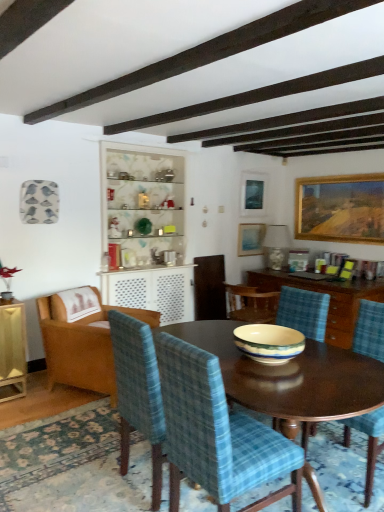
Question: Is white glossy cabinet at center at the left side of matte glass picture frame at upper center, placed as the second picture frame when sorted from left to right?

Choices:
 (A) no
 (B) yes

Answer: (B)

Question: Is white glossy cabinet at center positioned in front of matte glass picture frame at upper center, placed as the second picture frame when sorted from left to right?

Choices:
 (A) yes
 (B) no

Answer: (A)

Question: Does white glossy cabinet at center turn towards matte glass picture frame at upper center, placed as the second picture frame when sorted from left to right?

Choices:
 (A) no
 (B) yes

Answer: (A)

Question: Can you confirm if white glossy cabinet at center is thinner than matte glass picture frame at upper center, arranged as the 2th picture frame when viewed from the right?

Choices:
 (A) yes
 (B) no

Answer: (B)

Question: Can we say white glossy cabinet at center lies outside matte glass picture frame at upper center, arranged as the 2th picture frame when viewed from the right?

Choices:
 (A) yes
 (B) no

Answer: (A)

Question: In terms of size, does matte blue picture frame at upper center, which ranks as the first picture frame in left-to-right order, appear bigger or smaller than wooden cabinet at center?

Choices:
 (A) small
 (B) big

Answer: (A)

Question: From the image's perspective, is matte blue picture frame at upper center, which ranks as the first picture frame in left-to-right order, above or below wooden cabinet at center?

Choices:
 (A) below
 (B) above

Answer: (B)

Question: Considering the positions of matte blue picture frame at upper center, which ranks as the third picture frame in right-to-left order, and wooden cabinet at center in the image, is matte blue picture frame at upper center, which ranks as the third picture frame in right-to-left order, taller or shorter than wooden cabinet at center?

Choices:
 (A) short
 (B) tall

Answer: (A)

Question: From a real-world perspective, is matte blue picture frame at upper center, which ranks as the third picture frame in right-to-left order, above or below wooden cabinet at center?

Choices:
 (A) above
 (B) below

Answer: (A)

Question: From the image's perspective, relative to matte blue picture frame at upper center, which ranks as the third picture frame in right-to-left order, is matte glass picture frame at upper center, arranged as the 2th picture frame when viewed from the right, above or below?

Choices:
 (A) below
 (B) above

Answer: (B)

Question: Considering their positions, is matte glass picture frame at upper center, placed as the second picture frame when sorted from left to right, located in front of or behind matte blue picture frame at upper center, which ranks as the first picture frame in left-to-right order?

Choices:
 (A) front
 (B) behind

Answer: (A)

Question: In terms of height, does matte glass picture frame at upper center, placed as the second picture frame when sorted from left to right, look taller or shorter compared to matte blue picture frame at upper center, which ranks as the third picture frame in right-to-left order?

Choices:
 (A) short
 (B) tall

Answer: (B)

Question: Which is correct: matte glass picture frame at upper center, placed as the second picture frame when sorted from left to right, is inside matte blue picture frame at upper center, which ranks as the first picture frame in left-to-right order, or outside of it?

Choices:
 (A) inside
 (B) outside

Answer: (B)

Question: Looking at their shapes, would you say white fabric lampshade at upper center is wider or thinner than wooden cabinet at center?

Choices:
 (A) thin
 (B) wide

Answer: (A)

Question: From the image's perspective, is white fabric lampshade at upper center positioned above or below wooden cabinet at center?

Choices:
 (A) below
 (B) above

Answer: (B)